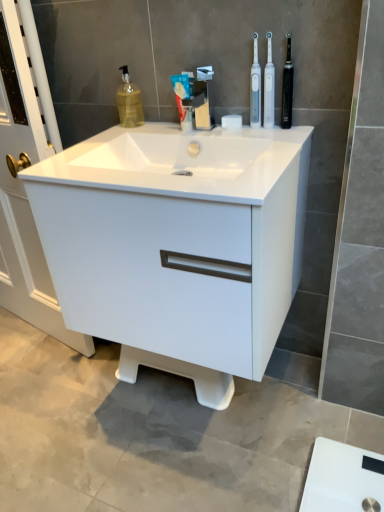
The image size is (384, 512). In order to click on free space in front of white plastic toothbrush at upper right, which is the 2th toothbrush in left-to-right order in this screenshot , I will do coord(281,135).